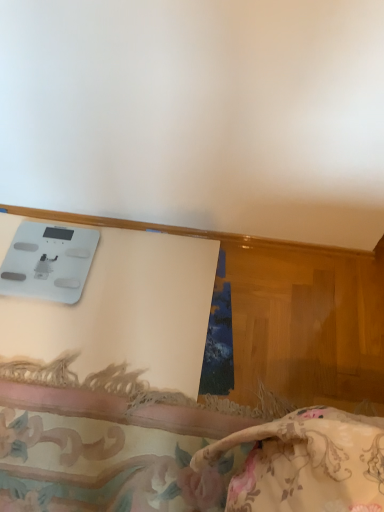
Locate an element on the screen. The image size is (384, 512). free space on the front side of white wood trim at upper center is located at coordinates (175, 339).